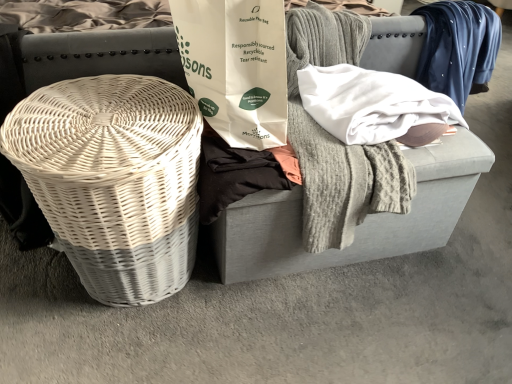
Question: Is white wicker basket at left thinner than gray fabric footrest at center?

Choices:
 (A) no
 (B) yes

Answer: (A)

Question: Considering the relative sizes of white wicker basket at left and gray fabric footrest at center in the image provided, is white wicker basket at left bigger than gray fabric footrest at center?

Choices:
 (A) yes
 (B) no

Answer: (B)

Question: Does white wicker basket at left appear on the left side of gray fabric footrest at center?

Choices:
 (A) no
 (B) yes

Answer: (B)

Question: From the image's perspective, is white wicker basket at left on top of gray fabric footrest at center?

Choices:
 (A) yes
 (B) no

Answer: (B)

Question: From a real-world perspective, is white wicker basket at left physically below gray fabric footrest at center?

Choices:
 (A) yes
 (B) no

Answer: (B)

Question: From a real-world perspective, is white wicker basket at left positioned above or below gray fabric footrest at center?

Choices:
 (A) above
 (B) below

Answer: (A)

Question: In terms of height, does white wicker basket at left look taller or shorter compared to gray fabric footrest at center?

Choices:
 (A) tall
 (B) short

Answer: (A)

Question: Looking at the image, does white wicker basket at left seem bigger or smaller compared to gray fabric footrest at center?

Choices:
 (A) big
 (B) small

Answer: (B)

Question: Is point (96, 107) positioned closer to the camera than point (244, 236)?

Choices:
 (A) closer
 (B) farther

Answer: (A)

Question: Considering the positions of white paper bag at center and black cotton shirt at center in the image, is white paper bag at center wider or thinner than black cotton shirt at center?

Choices:
 (A) wide
 (B) thin

Answer: (A)

Question: Would you say white paper bag at center is to the left or to the right of black cotton shirt at center in the picture?

Choices:
 (A) right
 (B) left

Answer: (B)

Question: Is white paper bag at center bigger or smaller than black cotton shirt at center?

Choices:
 (A) small
 (B) big

Answer: (B)

Question: From their relative heights in the image, would you say white paper bag at center is taller or shorter than black cotton shirt at center?

Choices:
 (A) tall
 (B) short

Answer: (A)

Question: Based on their sizes in the image, would you say gray fabric footrest at center is bigger or smaller than black cotton shirt at center?

Choices:
 (A) small
 (B) big

Answer: (B)

Question: Is point (264, 226) positioned closer to the camera than point (220, 208)?

Choices:
 (A) closer
 (B) farther

Answer: (B)